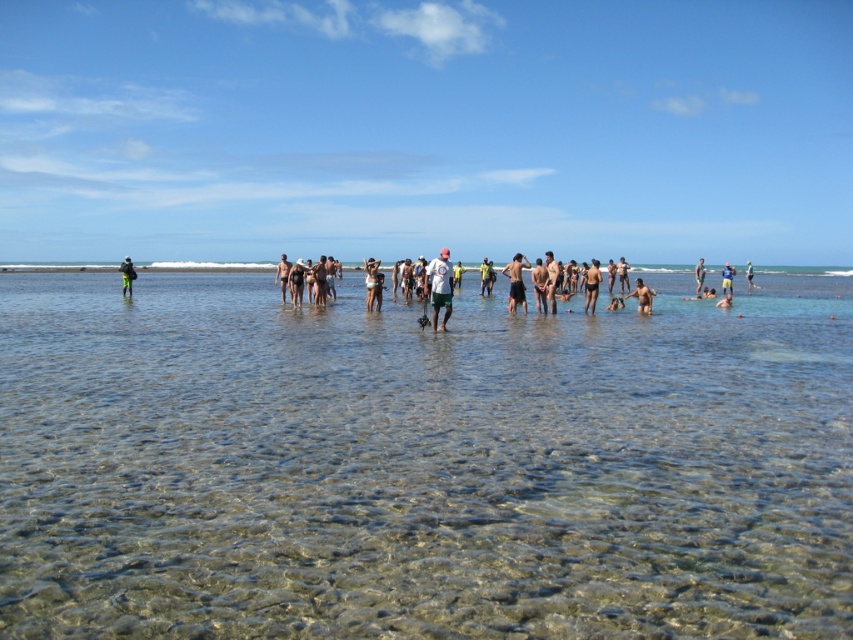
Question: Estimate the real-world distances between objects in this image. Which object is closer to the white matte shirt at center?

Choices:
 (A) white matte swimsuit at center
 (B) matte black swimsuit at center
 (C) green fabric shorts at center
 (D) smooth tan skin at center

Answer: (A)

Question: Which of the following is the farthest from the observer?

Choices:
 (A) smooth tan skin at center
 (B) clear water at center
 (C) light blue fabric shorts at center

Answer: (C)

Question: Does clear water at center appear under smooth tan skin at center?

Choices:
 (A) yes
 (B) no

Answer: (A)

Question: Is clear water at center positioned before black matte shorts at center?

Choices:
 (A) no
 (B) yes

Answer: (B)

Question: Based on their relative distances, which object is nearer to the black matte shorts at center?

Choices:
 (A) light blue fabric shorts at center
 (B) white cotton shirt at center
 (C) smooth tan skin at center
 (D) green fabric shorts at center

Answer: (B)

Question: Can you confirm if clear water at center is positioned above green fabric shorts at center?

Choices:
 (A) no
 (B) yes

Answer: (A)